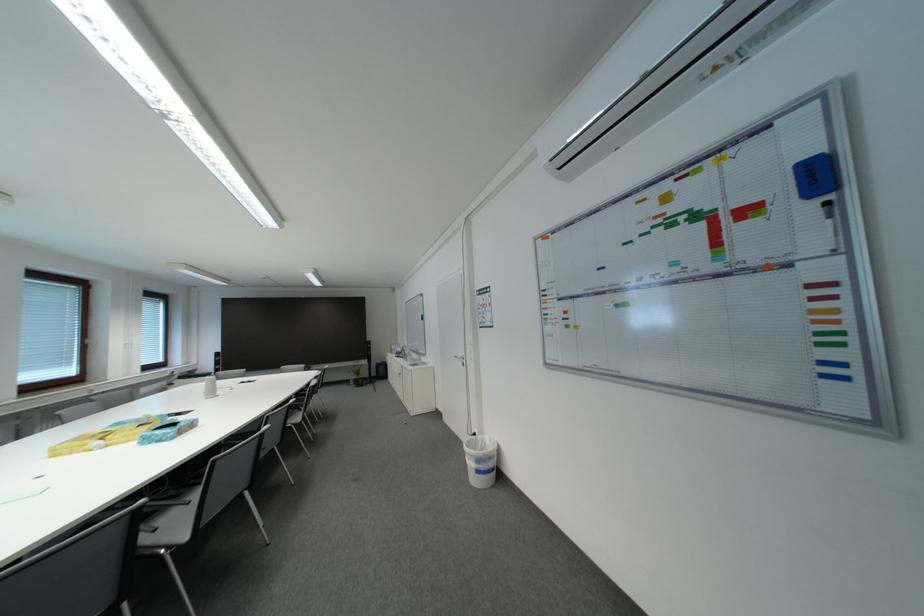
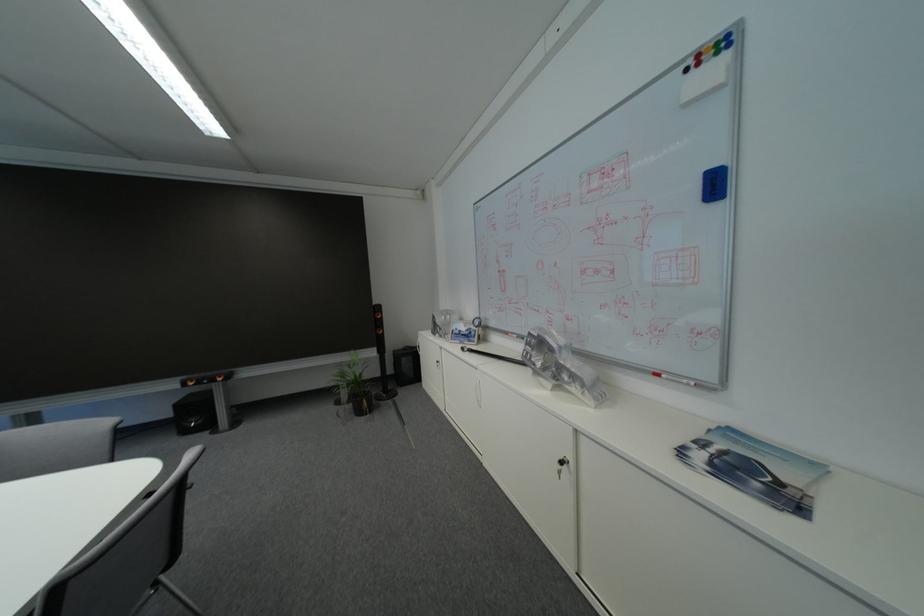
Locate, in the second image, the point that corresponds to point 361,384 in the first image.

(354, 399)